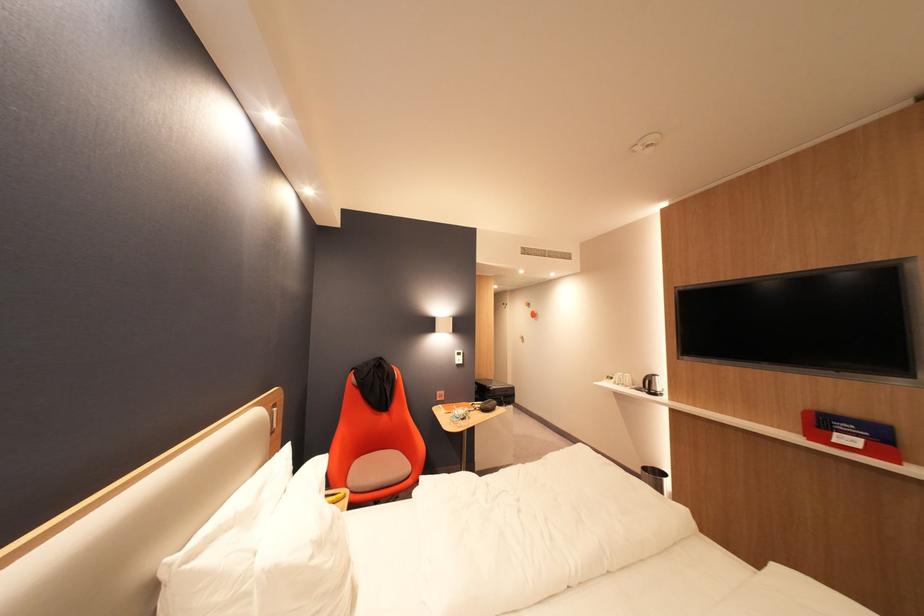
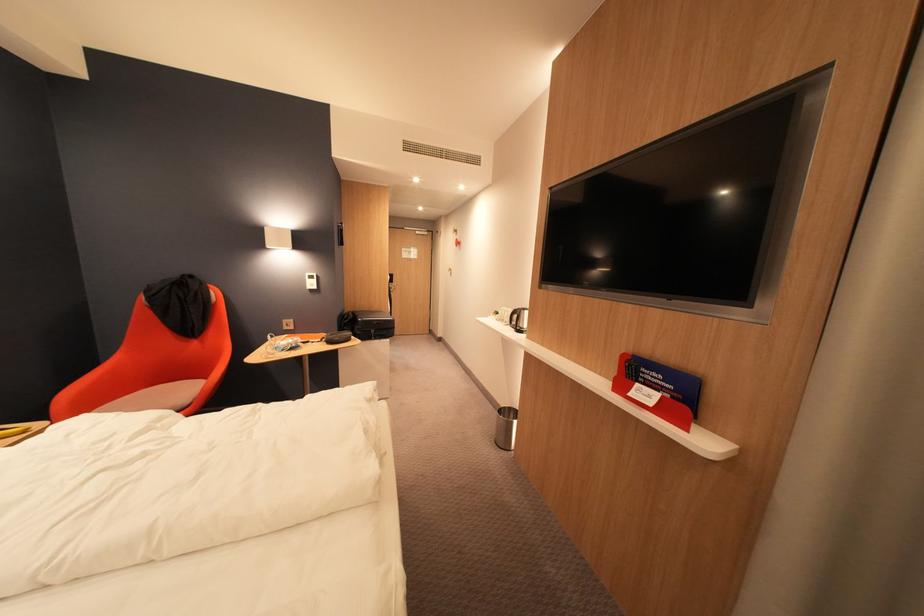
Locate, in the second image, the point that corresponds to point 846,435 in the first image.

(648, 386)